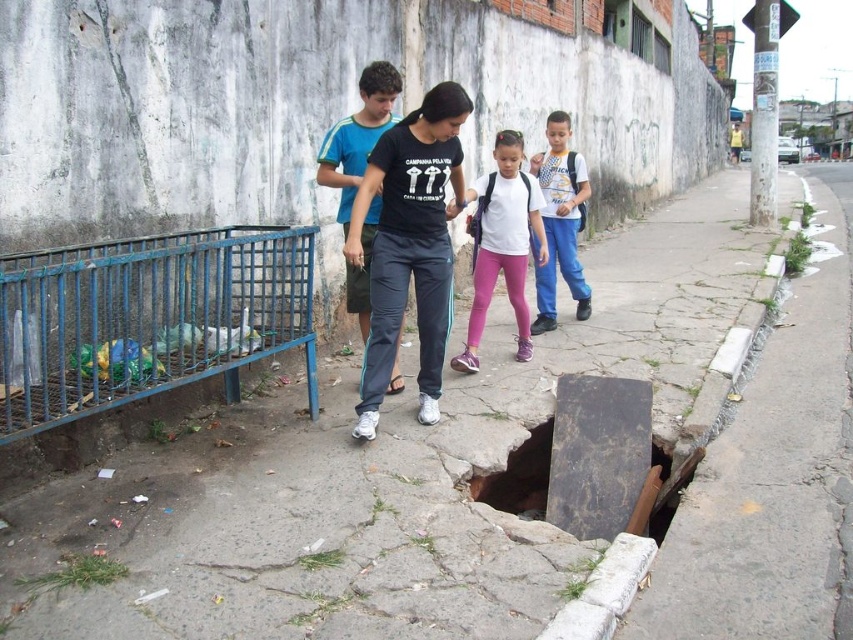
Question: Where is dark blue track pants at center located in relation to black cotton shirt at center in the image?

Choices:
 (A) below
 (B) above

Answer: (A)

Question: Which of the following is the farthest from the observer?

Choices:
 (A) (375, 138)
 (B) (480, 518)

Answer: (A)

Question: Does cracked concrete pavement at center appear over dark blue track pants at center?

Choices:
 (A) no
 (B) yes

Answer: (A)

Question: Which object appears closest to the camera in this image?

Choices:
 (A) black cotton shirt at center
 (B) cracked concrete pavement at center
 (C) blue jeans at center
 (D) dark blue track pants at center

Answer: (B)

Question: Which object appears closest to the camera in this image?

Choices:
 (A) black cotton shirt at center
 (B) dark blue track pants at center
 (C) blue jeans at center
 (D) white matte shirt at center

Answer: (B)

Question: Does dark blue track pants at center have a greater width compared to black cotton shirt at center?

Choices:
 (A) no
 (B) yes

Answer: (B)